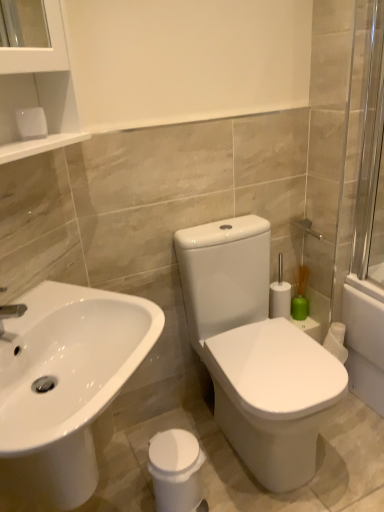
Where is `free location to the right of white glossy trash can at lower center`? The width and height of the screenshot is (384, 512). free location to the right of white glossy trash can at lower center is located at coordinates (238, 483).